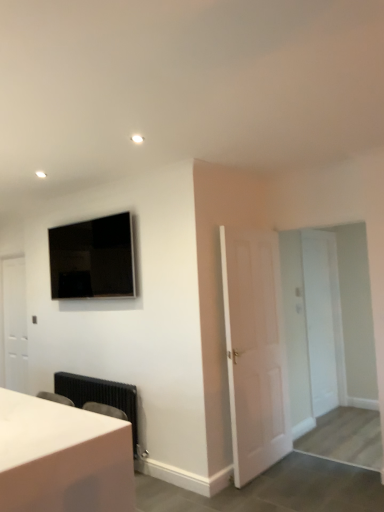
Find the location of a particular element. This screenshot has width=384, height=512. white glossy table at lower left is located at coordinates 62,458.

At what (x,y) coordinates should I click in order to perform the action: click on flat screen tv at upper left. Please return your answer as a coordinate pair (x, y). The height and width of the screenshot is (512, 384). Looking at the image, I should click on (93, 258).

What do you see at coordinates (93, 258) in the screenshot?
I see `flat screen tv at upper left` at bounding box center [93, 258].

Describe the element at coordinates (319, 322) in the screenshot. This screenshot has width=384, height=512. I see `white matte door at center, the 3th door in the left-to-right sequence` at that location.

Find the location of `black textured radiator at lower left`. black textured radiator at lower left is located at coordinates (100, 396).

This screenshot has width=384, height=512. What do you see at coordinates (255, 351) in the screenshot?
I see `white matte door at center, marked as the first door in a front-to-back arrangement` at bounding box center [255, 351].

At what (x,y) coordinates should I click in order to perform the action: click on white glossy table at lower left. Please return your answer as a coordinate pair (x, y). This screenshot has height=512, width=384. Looking at the image, I should click on (62, 458).

In terms of height, does black textured radiator at lower left look taller or shorter compared to flat screen tv at upper left?

Considering their sizes, black textured radiator at lower left has less height than flat screen tv at upper left.

From the image's perspective, is black textured radiator at lower left positioned above or below flat screen tv at upper left?

From the image's perspective, black textured radiator at lower left appears below flat screen tv at upper left.

Which of these two, black textured radiator at lower left or flat screen tv at upper left, is wider?

black textured radiator at lower left is wider.

How far apart are black textured radiator at lower left and flat screen tv at upper left?

black textured radiator at lower left and flat screen tv at upper left are 3.36 feet apart from each other.

The height and width of the screenshot is (512, 384). In order to click on television located above the white glossy table at lower left (from a real-world perspective) in this screenshot , I will do `click(93, 258)`.

Does point (24, 406) come closer to viewer compared to point (116, 224)?

Yes, it is.

Can you confirm if white glossy table at lower left is positioned to the right of flat screen tv at upper left?

Yes, white glossy table at lower left is to the right of flat screen tv at upper left.

From a real-world perspective, is white matte door at center, acting as the 2th door starting from the front, positioned over black textured radiator at lower left based on gravity?

Yes.

From the image's perspective, is white matte door at center, marked as the 2th door in a back-to-front arrangement, located beneath black textured radiator at lower left?

Actually, white matte door at center, marked as the 2th door in a back-to-front arrangement, appears above black textured radiator at lower left in the image.

Can you confirm if white matte door at center, marked as the 2th door in a back-to-front arrangement, is positioned to the right of black textured radiator at lower left?

Yes, white matte door at center, marked as the 2th door in a back-to-front arrangement, is to the right of black textured radiator at lower left.

Considering the sizes of objects white matte door at center, the 3th door in the left-to-right sequence, and black textured radiator at lower left in the image provided, who is smaller, white matte door at center, the 3th door in the left-to-right sequence, or black textured radiator at lower left?

white matte door at center, the 3th door in the left-to-right sequence.

Are white matte door at center, marked as the 2th door in a back-to-front arrangement, and white glossy table at lower left far apart?

Yes, white matte door at center, marked as the 2th door in a back-to-front arrangement, is far from white glossy table at lower left.

Considering the points (315, 372) and (121, 421), which point is in front, point (315, 372) or point (121, 421)?

The point (121, 421) is closer.

Can you confirm if white matte door at center, the first door viewed from the right, is positioned to the right of white glossy table at lower left?

Yes, white matte door at center, the first door viewed from the right, is to the right of white glossy table at lower left.

Is flat screen tv at upper left not close to white glossy table at lower left?

Yes, flat screen tv at upper left and white glossy table at lower left are located far from each other.

Is point (49, 256) positioned after point (68, 490)?

Yes, point (49, 256) is behind point (68, 490).

Identify the location of television on the left of white glossy table at lower left. (93, 258).

Which object is further away from the camera taking this photo, black textured radiator at lower left or white glossy table at lower left?

Positioned behind is black textured radiator at lower left.

Where is `radiator below the white glossy table at lower left (from the image's perspective)`? The width and height of the screenshot is (384, 512). radiator below the white glossy table at lower left (from the image's perspective) is located at coordinates (100, 396).

How different are the orientations of black textured radiator at lower left and white glossy table at lower left in degrees?

1.12 degrees separate the facing orientations of black textured radiator at lower left and white glossy table at lower left.

From the image's perspective, is black textured radiator at lower left on white glossy table at lower left?

No, from the image's perspective, black textured radiator at lower left is not on top of white glossy table at lower left.

Is white matte door at left, arranged as the 3th door when viewed from the front, oriented towards white matte door at center, marked as the 2th door in a back-to-front arrangement?

No, white matte door at left, arranged as the 3th door when viewed from the front, is not turned towards white matte door at center, marked as the 2th door in a back-to-front arrangement.

Based on the photo, what's the angular difference between white matte door at left, which is the first door from left to right, and white matte door at center, acting as the 2th door starting from the front,'s facing directions?

There is a 90-degree angle between the facing directions of white matte door at left, which is the first door from left to right, and white matte door at center, acting as the 2th door starting from the front.

From a real-world perspective, is white matte door at left, which ranks as the first door in back-to-front order, on white matte door at center, the first door viewed from the right?

Yes.

Measure the distance between white matte door at left, placed as the 3th door when sorted from right to left, and white matte door at center, the first door viewed from the right.

white matte door at left, placed as the 3th door when sorted from right to left, is 3.37 meters away from white matte door at center, the first door viewed from the right.

Find the location of a particular element. This screenshot has height=512, width=384. television above the black textured radiator at lower left (from the image's perspective) is located at coordinates (93, 258).

At what (x,y) coordinates should I click in order to perform the action: click on television on the left of white glossy table at lower left. Please return your answer as a coordinate pair (x, y). Image resolution: width=384 pixels, height=512 pixels. Looking at the image, I should click on (93, 258).

From the image, which object appears to be farther from black textured radiator at lower left, flat screen tv at upper left or white matte door at left, which ranks as the first door in back-to-front order?

Based on the image, white matte door at left, which ranks as the first door in back-to-front order, appears to be further to black textured radiator at lower left.

Based on the photo, considering their positions, is white matte door at center, acting as the 2th door starting from the front, positioned closer to white matte door at left, placed as the 3th door when sorted from right to left, than white glossy table at lower left?

white glossy table at lower left is positioned closer to the anchor white matte door at left, placed as the 3th door when sorted from right to left.

Consider the image. When comparing their distances from black textured radiator at lower left, does white matte door at center, the 3th door in the left-to-right sequence, or white glossy table at lower left seem further?

white matte door at center, the 3th door in the left-to-right sequence, lies further to black textured radiator at lower left than the other object.

Estimate the real-world distances between objects in this image. Which object is closer to white matte door at center, the 3th door in the left-to-right sequence, white matte door at center, placed as the 3th door when sorted from back to front, or white glossy table at lower left?

The object closer to white matte door at center, the 3th door in the left-to-right sequence, is white matte door at center, placed as the 3th door when sorted from back to front.

Considering their positions, is white matte door at left, which ranks as the first door in back-to-front order, positioned further to black textured radiator at lower left than white matte door at center, the 3th door in the left-to-right sequence?

white matte door at center, the 3th door in the left-to-right sequence, is further to black textured radiator at lower left.

When comparing their distances from white glossy table at lower left, does white matte door at left, which is the first door from left to right, or flat screen tv at upper left seem further?

white matte door at left, which is the first door from left to right.

From the image, which object appears to be farther from flat screen tv at upper left, white matte door at center, marked as the first door in a front-to-back arrangement, or white glossy table at lower left?

white glossy table at lower left is further to flat screen tv at upper left.

From the picture: When comparing their distances from white matte door at center, placed as the 3th door when sorted from back to front, does white glossy table at lower left or black textured radiator at lower left seem closer?

black textured radiator at lower left is closer to white matte door at center, placed as the 3th door when sorted from back to front.

I want to click on door between white matte door at left, placed as the 3th door when sorted from right to left, and white matte door at center, the 3th door in the left-to-right sequence, so click(255, 351).

Find the location of `television between black textured radiator at lower left and white matte door at left, which ranks as the first door in back-to-front order, in the front-back direction`. television between black textured radiator at lower left and white matte door at left, which ranks as the first door in back-to-front order, in the front-back direction is located at coordinates (93, 258).

You are a GUI agent. You are given a task and a screenshot of the screen. Output one action in this format:
    pyautogui.click(x=<x>, y=<y>)
    Task: Click on the radiator between flat screen tv at upper left and white matte door at center, marked as the first door in a front-to-back arrangement, in the horizontal direction
    
    Given the screenshot: What is the action you would take?
    pyautogui.click(x=100, y=396)

Locate an element on the screen. door located between white glossy table at lower left and black textured radiator at lower left in the depth direction is located at coordinates (255, 351).